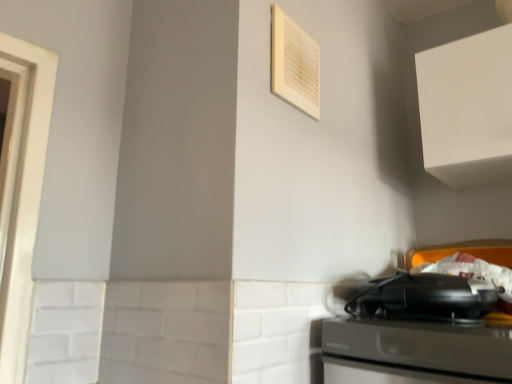
Question: Considering the positions of white plastic air conditioner at upper center and white matte cabinet at upper right in the image, is white plastic air conditioner at upper center wider or thinner than white matte cabinet at upper right?

Choices:
 (A) wide
 (B) thin

Answer: (B)

Question: From their relative heights in the image, would you say white plastic air conditioner at upper center is taller or shorter than white matte cabinet at upper right?

Choices:
 (A) tall
 (B) short

Answer: (B)

Question: Based on their relative distances, which object is farther from the white matte cabinet at upper right?

Choices:
 (A) white plastic air conditioner at upper center
 (B) black plastic toaster at lower right

Answer: (A)

Question: Which is farther from the black plastic toaster at lower right?

Choices:
 (A) white plastic air conditioner at upper center
 (B) white matte cabinet at upper right

Answer: (A)